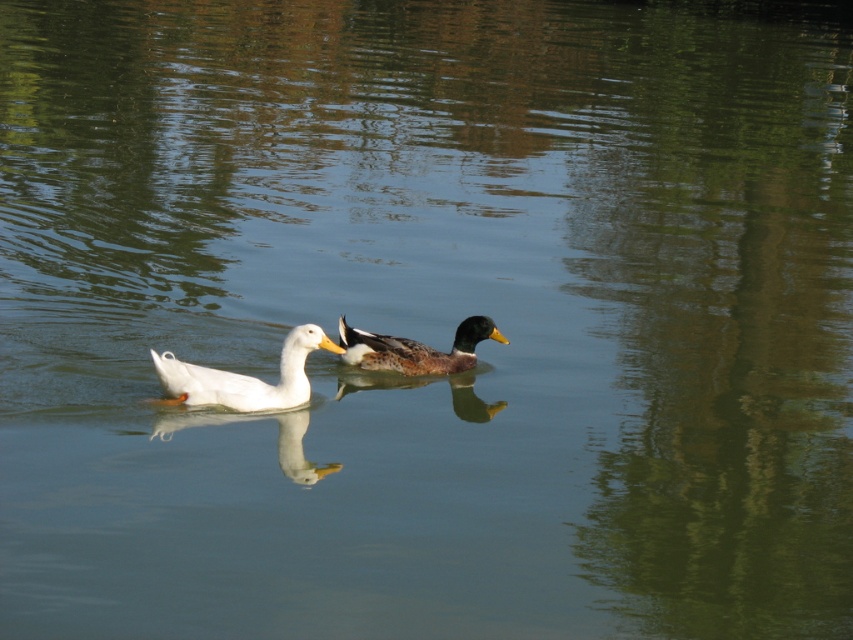
Question: Can you confirm if white matte duck at center is positioned to the left of shiny brown duck at center?

Choices:
 (A) no
 (B) yes

Answer: (B)

Question: Which point is farther to the camera?

Choices:
 (A) white matte duck at center
 (B) shiny brown duck at center

Answer: (B)

Question: Which point is farther to the camera?

Choices:
 (A) (225, 396)
 (B) (343, 356)

Answer: (B)

Question: Does white matte duck at center have a lesser width compared to shiny brown duck at center?

Choices:
 (A) no
 (B) yes

Answer: (A)

Question: Where is white matte duck at center located in relation to shiny brown duck at center in the image?

Choices:
 (A) left
 (B) right

Answer: (A)